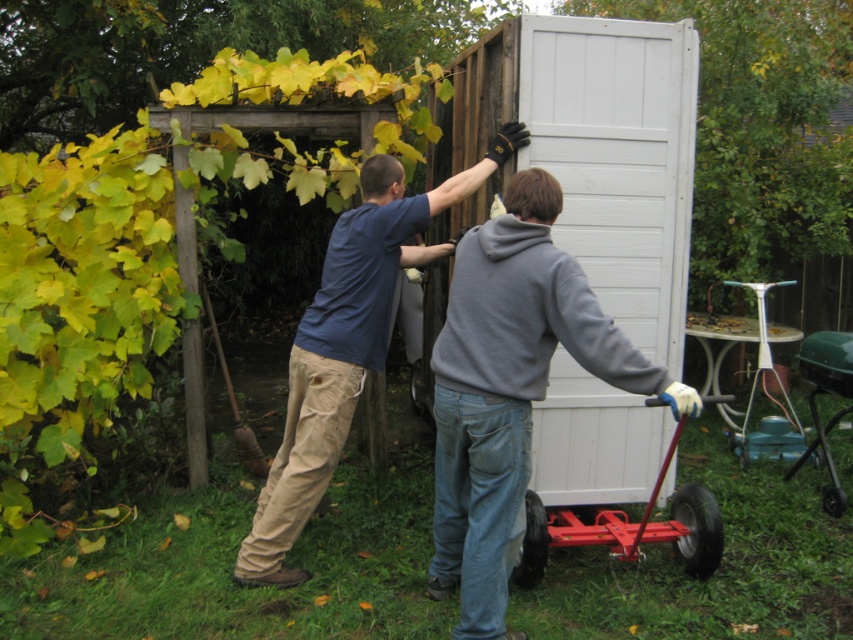
Question: Which point is farther to the camera?

Choices:
 (A) gray fleece hoodie at center
 (B) blue cotton shirt at center
 (C) metallic red wagon at lower center

Answer: (B)

Question: Is gray fleece hoodie at center behind metallic red wagon at lower center?

Choices:
 (A) yes
 (B) no

Answer: (B)

Question: Does blue cotton shirt at center have a smaller size compared to metallic red wagon at lower center?

Choices:
 (A) yes
 (B) no

Answer: (B)

Question: Which point is farther from the camera taking this photo?

Choices:
 (A) (463, 237)
 (B) (525, 499)

Answer: (B)

Question: Which of the following is the closest to the observer?

Choices:
 (A) (473, 422)
 (B) (323, 376)
 (C) (627, 531)

Answer: (A)

Question: Does blue cotton shirt at center appear under metallic red wagon at lower center?

Choices:
 (A) yes
 (B) no

Answer: (B)